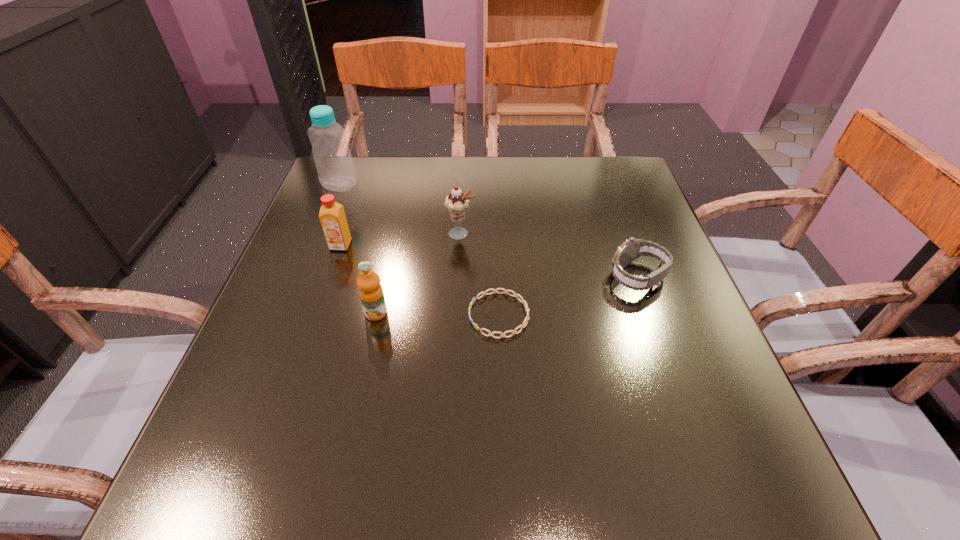
This screenshot has width=960, height=540. I want to click on bottle that is at the left edge, so click(x=334, y=163).

Locate an element on the screen. The image size is (960, 540). orange juice that is at the left edge is located at coordinates (332, 216).

Where is `object at the right edge`? object at the right edge is located at coordinates (631, 249).

Identify the location of object situated at the far left corner. (334, 163).

At what (x,y) coordinates should I click in order to perform the action: click on vacant area at the far edge. Please return your answer as a coordinate pair (x, y). Looking at the image, I should click on (483, 186).

Locate an element on the screen. vacant position at the near edge of the desktop is located at coordinates (383, 460).

In the image, there is a desktop. What are the coordinates of `vacant space at the left edge` in the screenshot? It's located at (360, 224).

Identify the location of free space at the right edge. (727, 429).

Find the location of a particular element. Image resolution: width=960 pixels, height=540 pixels. vacant area at the far left corner is located at coordinates (341, 195).

Where is `free space at the near left corner`? This screenshot has width=960, height=540. free space at the near left corner is located at coordinates (266, 477).